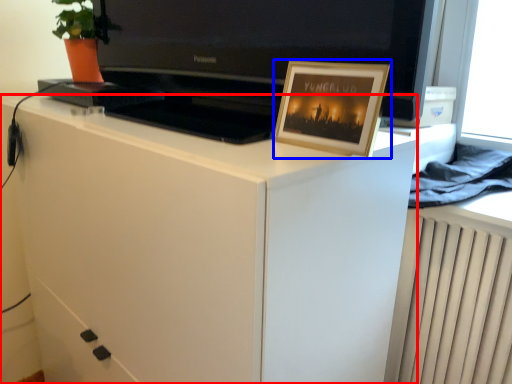
Question: Which of the following is the closest to the observer, cabinetry (highlighted by a red box) or picture frame (highlighted by a blue box)?

Choices:
 (A) cabinetry
 (B) picture frame

Answer: (A)